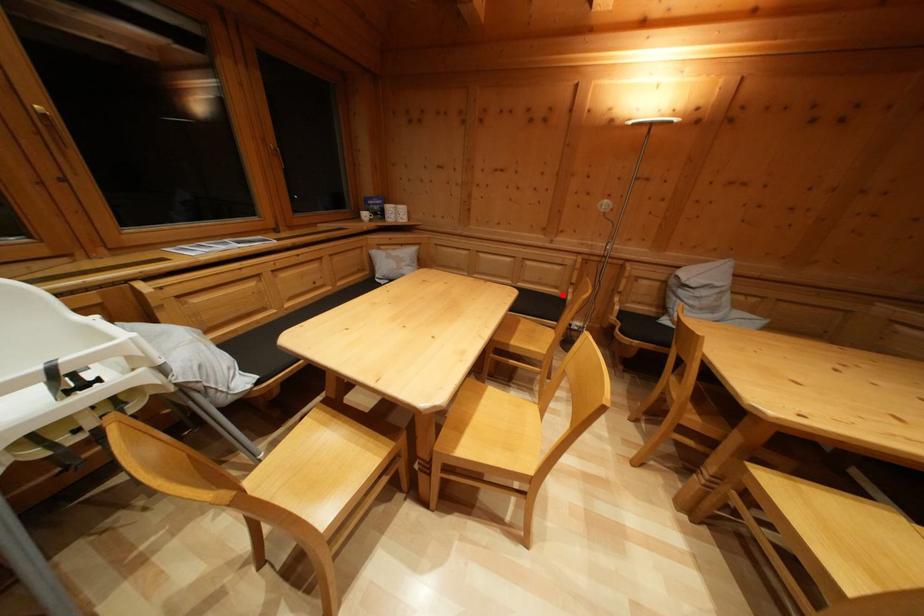
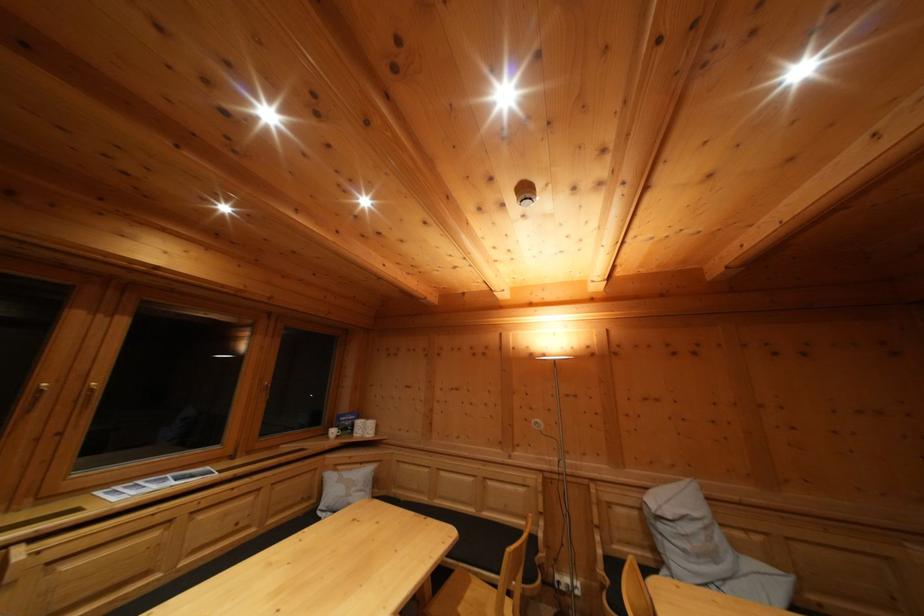
Question: I am providing you with two images of the same scene from different viewpoints. In image1, a red point is highlighted. Considering the same 3D point in image2, which of the following is correct?

Choices:
 (A) It is closer
 (B) It is farther

Answer: (B)